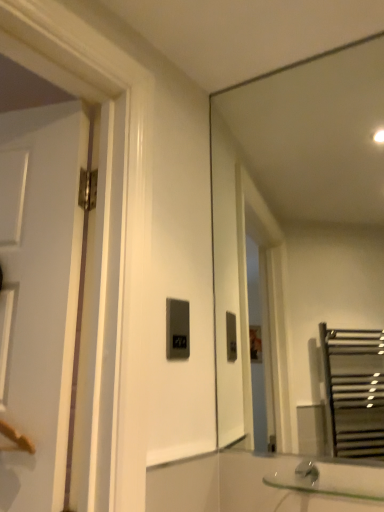
Question: Is clear glass sink at lower right bigger than transparent glass mirror at upper right?

Choices:
 (A) yes
 (B) no

Answer: (B)

Question: Does clear glass sink at lower right have a lesser width compared to transparent glass mirror at upper right?

Choices:
 (A) yes
 (B) no

Answer: (B)

Question: Does clear glass sink at lower right have a greater height compared to transparent glass mirror at upper right?

Choices:
 (A) no
 (B) yes

Answer: (A)

Question: From a real-world perspective, is clear glass sink at lower right below transparent glass mirror at upper right?

Choices:
 (A) yes
 (B) no

Answer: (A)

Question: From the image's perspective, is clear glass sink at lower right on transparent glass mirror at upper right?

Choices:
 (A) no
 (B) yes

Answer: (A)

Question: Is clear glass sink at lower right further to the viewer compared to transparent glass mirror at upper right?

Choices:
 (A) no
 (B) yes

Answer: (A)

Question: Is transparent glass mirror at upper right wider than matte black switch at center?

Choices:
 (A) no
 (B) yes

Answer: (B)

Question: Is matte black switch at center at the back of transparent glass mirror at upper right?

Choices:
 (A) no
 (B) yes

Answer: (A)

Question: From the image's perspective, would you say transparent glass mirror at upper right is positioned over matte black switch at center?

Choices:
 (A) yes
 (B) no

Answer: (A)

Question: Is transparent glass mirror at upper right next to matte black switch at center and touching it?

Choices:
 (A) no
 (B) yes

Answer: (A)

Question: Is transparent glass mirror at upper right to the right of matte black switch at center from the viewer's perspective?

Choices:
 (A) yes
 (B) no

Answer: (A)

Question: Is the depth of transparent glass mirror at upper right greater than that of matte black switch at center?

Choices:
 (A) yes
 (B) no

Answer: (B)

Question: From the image's perspective, is matte black switch at center on top of clear glass sink at lower right?

Choices:
 (A) no
 (B) yes

Answer: (B)